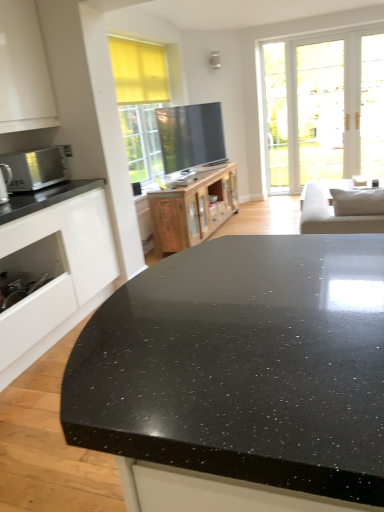
Question: Is satin silver microwave at left not inside white glossy cabinet at left, marked as the 2th cabinetry in a back-to-front arrangement?

Choices:
 (A) yes
 (B) no

Answer: (A)

Question: From the image's perspective, is satin silver microwave at left below white glossy cabinet at left, marked as the 2th cabinetry in a back-to-front arrangement?

Choices:
 (A) no
 (B) yes

Answer: (A)

Question: Can you confirm if satin silver microwave at left is positioned to the left of white glossy cabinet at left, the 1th cabinetry viewed from the left?

Choices:
 (A) no
 (B) yes

Answer: (A)

Question: Does satin silver microwave at left have a smaller size compared to white glossy cabinet at left, arranged as the second cabinetry when viewed from the right?

Choices:
 (A) no
 (B) yes

Answer: (B)

Question: From a real-world perspective, is satin silver microwave at left physically below white glossy cabinet at left, arranged as the second cabinetry when viewed from the right?

Choices:
 (A) no
 (B) yes

Answer: (A)

Question: In terms of width, does white glossy cabinet at left, arranged as the second cabinetry when viewed from the right, look wider or thinner when compared to satin silver microwave at left?

Choices:
 (A) thin
 (B) wide

Answer: (B)

Question: Is point (89, 296) positioned closer to the camera than point (31, 173)?

Choices:
 (A) closer
 (B) farther

Answer: (B)

Question: Visually, is white glossy cabinet at left, marked as the 2th cabinetry in a back-to-front arrangement, positioned to the left or to the right of satin silver microwave at left?

Choices:
 (A) right
 (B) left

Answer: (B)

Question: Looking at the image, does white glossy cabinet at left, marked as the 2th cabinetry in a back-to-front arrangement, seem bigger or smaller compared to satin silver microwave at left?

Choices:
 (A) big
 (B) small

Answer: (A)

Question: Looking at the image, does satin silver microwave at left seem bigger or smaller compared to black speckled granite countertop at center?

Choices:
 (A) small
 (B) big

Answer: (A)

Question: Is point (18, 161) closer or farther from the camera than point (190, 266)?

Choices:
 (A) closer
 (B) farther

Answer: (B)

Question: Is satin silver microwave at left in front of or behind black speckled granite countertop at center in the image?

Choices:
 (A) behind
 (B) front

Answer: (A)

Question: From a real-world perspective, is satin silver microwave at left positioned above or below black speckled granite countertop at center?

Choices:
 (A) below
 (B) above

Answer: (B)

Question: In the image, is wooden cabinet at center, which ranks as the 1th cabinetry in back-to-front order, positioned in front of or behind satin silver microwave at left?

Choices:
 (A) front
 (B) behind

Answer: (B)

Question: Is wooden cabinet at center, acting as the second cabinetry starting from the left, spatially inside satin silver microwave at left, or outside of it?

Choices:
 (A) outside
 (B) inside

Answer: (A)